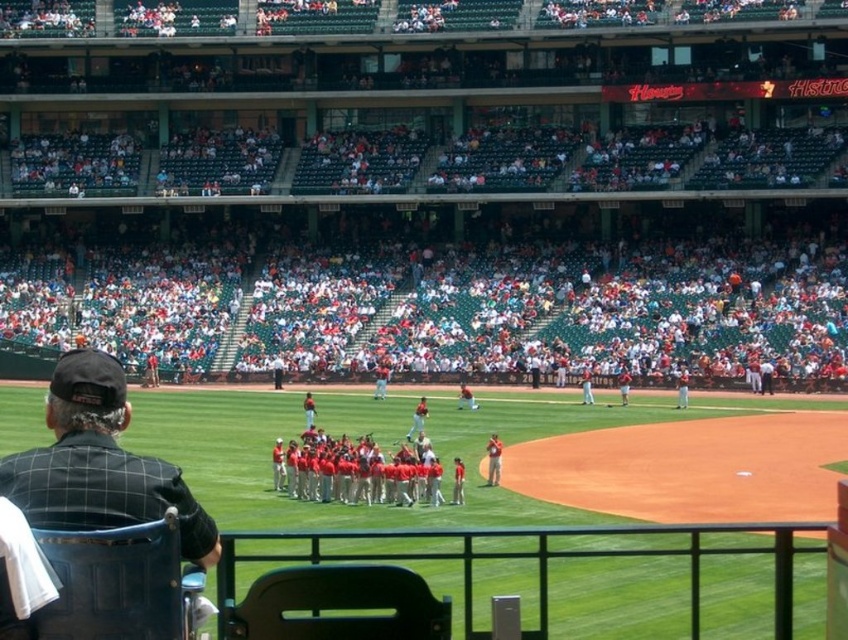
Question: Which of the following is the farthest from the observer?

Choices:
 (A) (291, 461)
 (B) (85, 477)

Answer: (A)

Question: Which point is closer to the camera taking this photo?

Choices:
 (A) (360, 470)
 (B) (140, 460)

Answer: (B)

Question: Which point is closer to the camera taking this photo?

Choices:
 (A) (135, 483)
 (B) (424, 461)

Answer: (A)

Question: Does black mesh chair at lower left come in front of red uniformed players at center?

Choices:
 (A) no
 (B) yes

Answer: (B)

Question: Where is black mesh chair at lower left located in relation to red uniformed players at center in the image?

Choices:
 (A) below
 (B) above

Answer: (B)

Question: Observing the image, what is the correct spatial positioning of black mesh chair at lower left in reference to red uniformed players at center?

Choices:
 (A) above
 (B) below

Answer: (A)